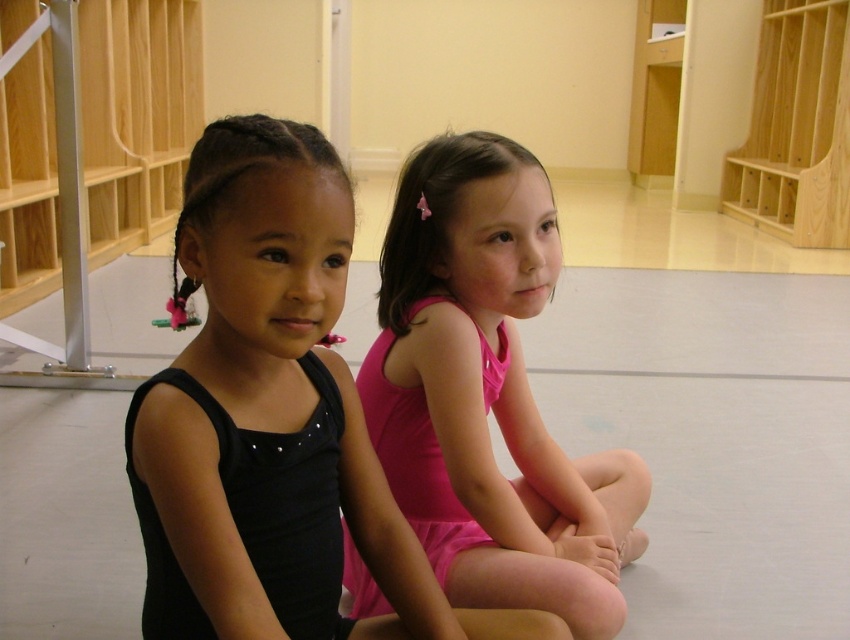
Measure the distance between black matte leotard at left and camera.

The distance of black matte leotard at left from camera is 31.35 inches.

Between black matte leotard at left and pink satin leotard at center, which one has more height?

pink satin leotard at center

Identify the location of black matte leotard at left. The height and width of the screenshot is (640, 850). (272, 419).

Find the location of a particular element. The height and width of the screenshot is (640, 850). black matte leotard at left is located at coordinates (272, 419).